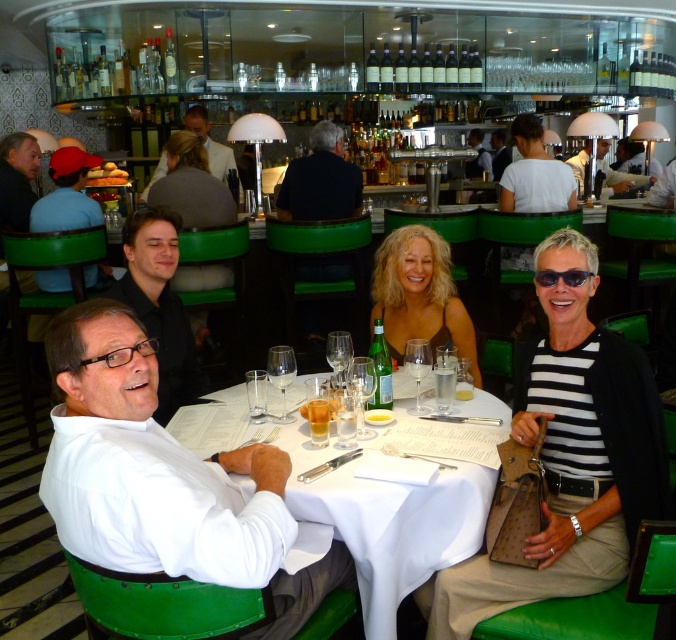
Does dark blue shirt at center appear over white shirt at center?

Actually, dark blue shirt at center is below white shirt at center.

Between dark blue shirt at center and white shirt at center, which one has more height?

white shirt at center is taller.

Does point (329, 177) lie behind point (635, 173)?

No, (329, 177) is in front of (635, 173).

What are the coordinates of `dark blue shirt at center` in the screenshot? It's located at (320, 180).

Is dark blue shirt at center positioned before matte blue shirt at left?

No, dark blue shirt at center is behind matte blue shirt at left.

Does dark blue shirt at center have a greater height compared to matte blue shirt at left?

Indeed, dark blue shirt at center has a greater height compared to matte blue shirt at left.

Who is more forward, (337,161) or (57,275)?

Point (57,275) is more forward.

This screenshot has width=676, height=640. I want to click on dark blue shirt at center, so click(x=320, y=180).

Can you confirm if white matte shirt at center is positioned above black and white striped shirt at center?

No.

Does point (114, 456) come farther from viewer compared to point (573, 396)?

No, it is in front of (573, 396).

Is point (249, 576) positioned before point (539, 456)?

Yes, point (249, 576) is closer to viewer.

Where is `white matte shirt at center`? white matte shirt at center is located at coordinates (164, 480).